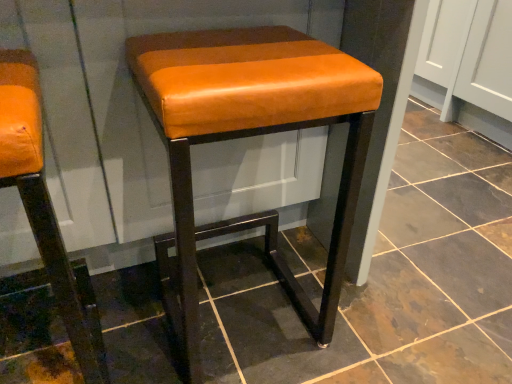
Question: In terms of height, does matte orange leather stool at center, marked as the first stool in a right-to-left arrangement, look taller or shorter compared to orange leather stool at left, the second stool in the right-to-left sequence?

Choices:
 (A) short
 (B) tall

Answer: (A)

Question: In the image, is matte orange leather stool at center, which appears as the 2th stool when viewed from the left, on the left side or the right side of orange leather stool at left, the second stool in the right-to-left sequence?

Choices:
 (A) left
 (B) right

Answer: (B)

Question: From the image's perspective, is matte orange leather stool at center, marked as the first stool in a right-to-left arrangement, positioned above or below orange leather stool at left, the second stool in the right-to-left sequence?

Choices:
 (A) above
 (B) below

Answer: (A)

Question: Do you think orange leather stool at left, the first stool in the left-to-right sequence, is within matte orange leather stool at center, which appears as the 2th stool when viewed from the left, or outside of it?

Choices:
 (A) outside
 (B) inside

Answer: (A)

Question: From the image's perspective, is orange leather stool at left, the first stool in the left-to-right sequence, positioned above or below matte orange leather stool at center, which appears as the 2th stool when viewed from the left?

Choices:
 (A) above
 (B) below

Answer: (B)

Question: In terms of height, does orange leather stool at left, the first stool in the left-to-right sequence, look taller or shorter compared to matte orange leather stool at center, marked as the first stool in a right-to-left arrangement?

Choices:
 (A) short
 (B) tall

Answer: (B)

Question: Is orange leather stool at left, the first stool in the left-to-right sequence, wider or thinner than matte orange leather stool at center, marked as the first stool in a right-to-left arrangement?

Choices:
 (A) wide
 (B) thin

Answer: (B)